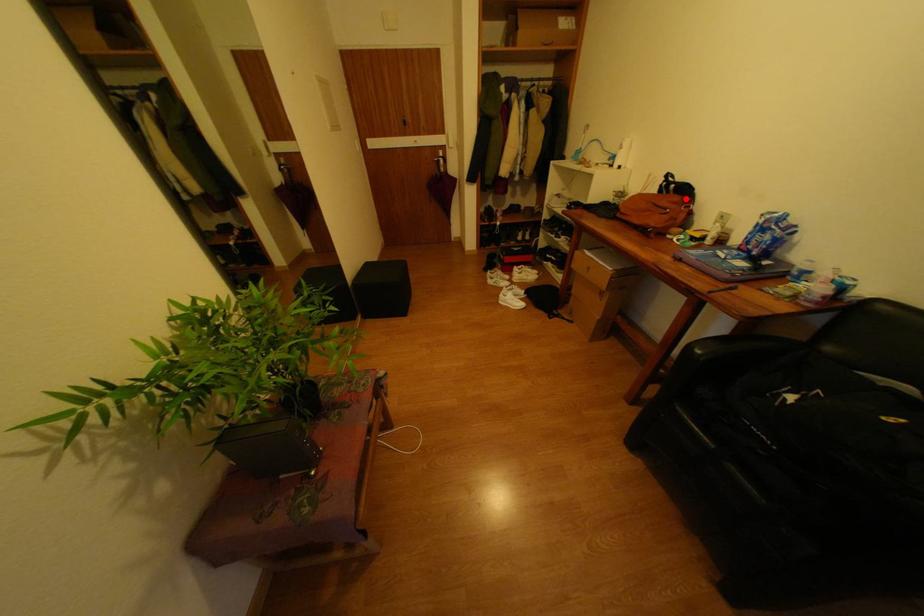
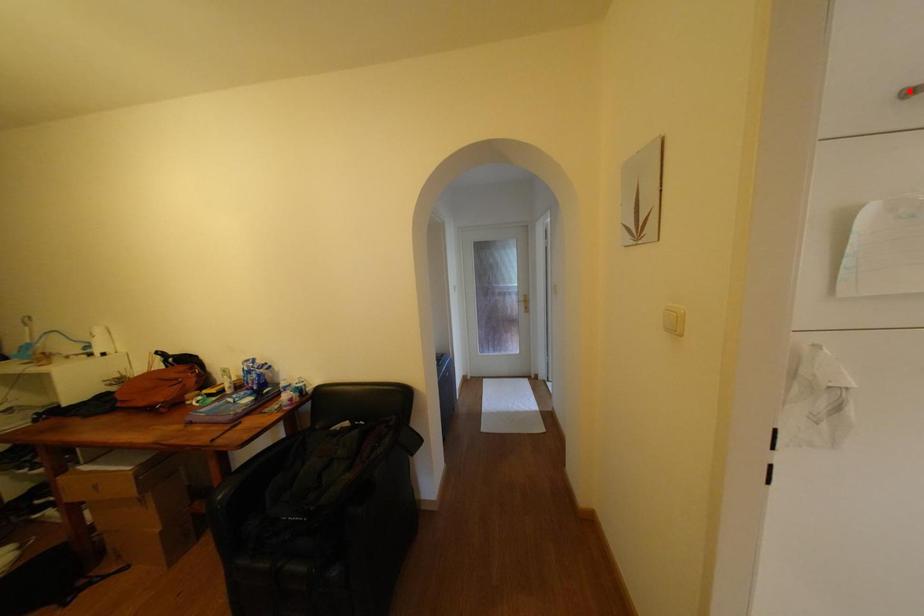
I am providing you with two images of the same scene from different viewpoints. A red point is marked on the first image and another point is marked on the second image. Do the highlighted points in image1 and image2 indicate the same real-world spot?

No